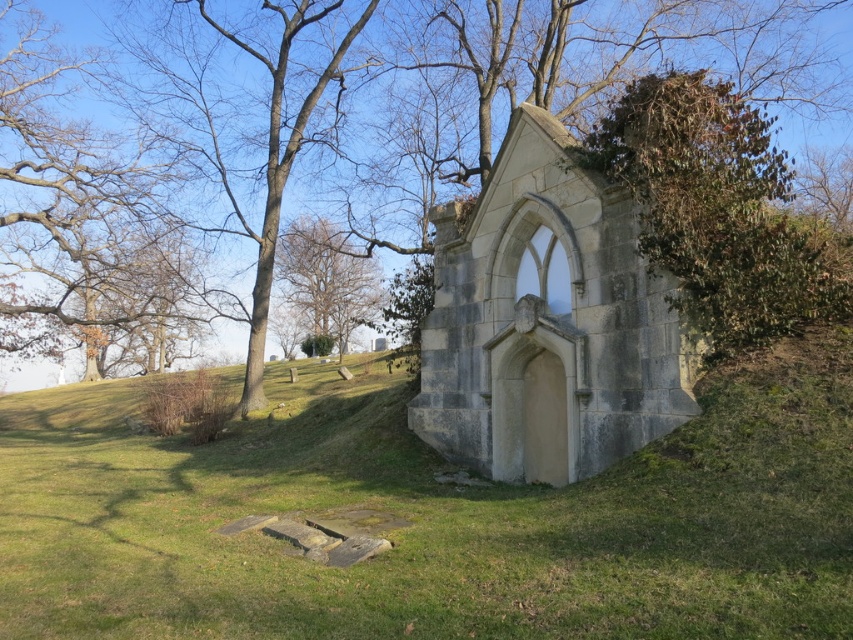
Question: Does green leafy tree at center have a lesser width compared to brown bark tree at upper left?

Choices:
 (A) no
 (B) yes

Answer: (A)

Question: Can you confirm if green leafy tree at center is positioned to the left of brown leafy tree at upper left?

Choices:
 (A) yes
 (B) no

Answer: (B)

Question: Which point is closer to the camera?

Choices:
 (A) (335, 608)
 (B) (289, 244)

Answer: (A)

Question: Which of the following is the farthest from the observer?

Choices:
 (A) (109, 161)
 (B) (28, 74)
 (C) (697, 102)
 (D) (170, 116)

Answer: (A)

Question: Can you confirm if green leafy bush at upper right is smaller than brown bark tree at upper left?

Choices:
 (A) yes
 (B) no

Answer: (A)

Question: Among these objects, which one is nearest to the camera?

Choices:
 (A) brown leafless tree at upper center
 (B) brown leafy tree at upper left

Answer: (B)